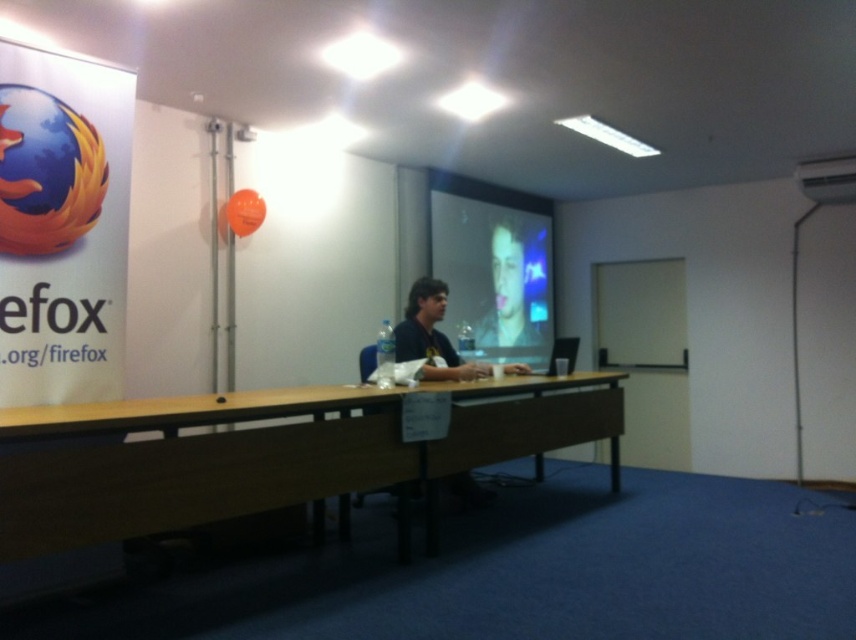
Question: Among these objects, which one is nearest to the camera?

Choices:
 (A) smooth skin at center
 (B) dark blue shirt at center
 (C) matte plastic projector screen at center

Answer: (B)

Question: Does matte plastic projector screen at center have a lesser width compared to smooth skin at center?

Choices:
 (A) no
 (B) yes

Answer: (A)

Question: Where is brown wooden table at center located in relation to dark blue shirt at center in the image?

Choices:
 (A) below
 (B) above

Answer: (A)

Question: Which point is farther from the camera taking this photo?

Choices:
 (A) (146, 532)
 (B) (496, 236)
 (C) (528, 204)

Answer: (C)

Question: Does matte plastic projector screen at center have a greater width compared to dark blue shirt at center?

Choices:
 (A) yes
 (B) no

Answer: (A)

Question: Which point appears farthest from the camera in this image?

Choices:
 (A) (520, 339)
 (B) (425, 304)
 (C) (490, 336)

Answer: (A)